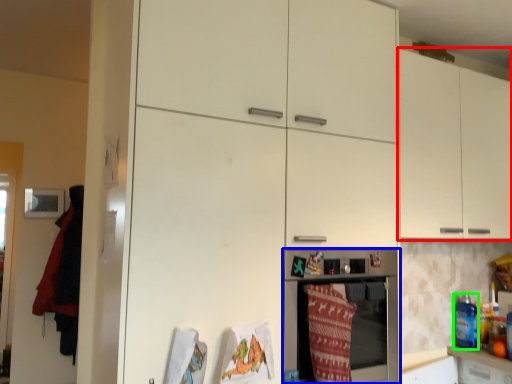
Question: Estimate the real-world distances between objects in this image. Which object is farther from cabinetry (highlighted by a red box), home appliance (highlighted by a blue box) or beverage (highlighted by a green box)?

Choices:
 (A) home appliance
 (B) beverage

Answer: (B)